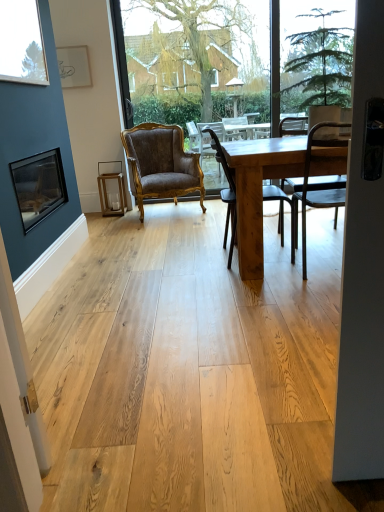
You are a GUI agent. You are given a task and a screenshot of the screen. Output one action in this format:
    pyautogui.click(x=<x>, y=<y>)
    Task: Click on the free spot in front of velvet gold armchair at center, which ranks as the 3th chair in right-to-left order
    Image resolution: width=384 pixels, height=512 pixels.
    Given the screenshot: What is the action you would take?
    pyautogui.click(x=151, y=227)